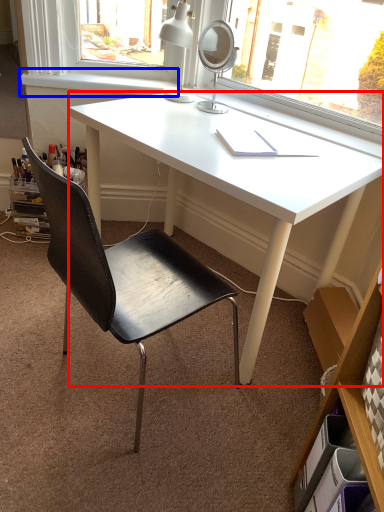
Question: Which object is further to the camera taking this photo, desk (highlighted by a red box) or window sill (highlighted by a blue box)?

Choices:
 (A) desk
 (B) window sill

Answer: (B)